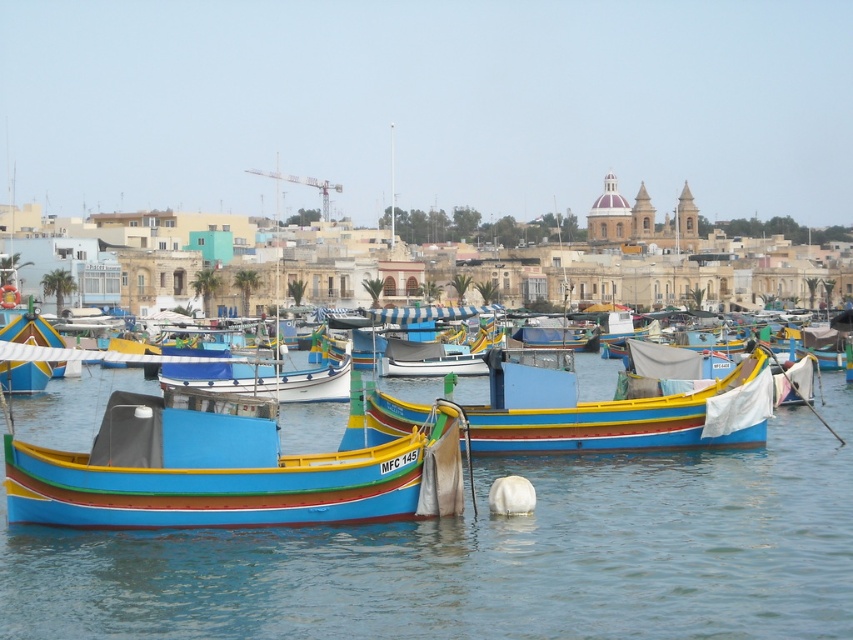
Question: Considering the real-world distances, which object is farthest from the multicolored painted boat at center?

Choices:
 (A) blue water at center
 (B) multicolored wooden boat at center

Answer: (B)

Question: Does blue water at center appear under multicolored wooden boat at center?

Choices:
 (A) no
 (B) yes

Answer: (B)

Question: Which point appears closest to the camera in this image?

Choices:
 (A) (47, 588)
 (B) (326, 499)
 (C) (576, 396)

Answer: (A)

Question: Among these points, which one is nearest to the camera?

Choices:
 (A) (183, 477)
 (B) (753, 369)
 (C) (612, 620)

Answer: (C)

Question: Where is blue water at center located in relation to multicolored wooden boat at center in the image?

Choices:
 (A) left
 (B) right

Answer: (B)

Question: In this image, where is blue water at center located relative to multicolored wooden boat at center?

Choices:
 (A) left
 (B) right

Answer: (B)